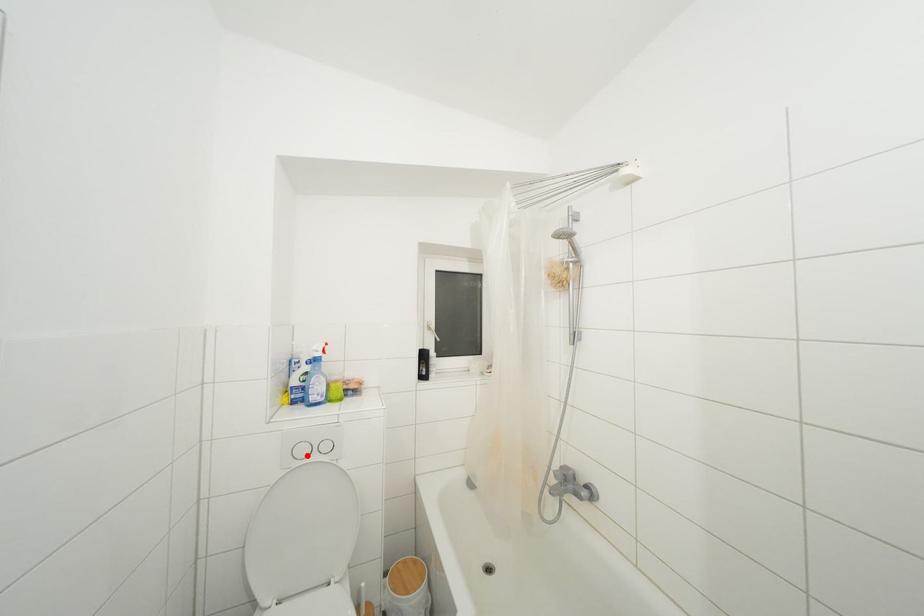
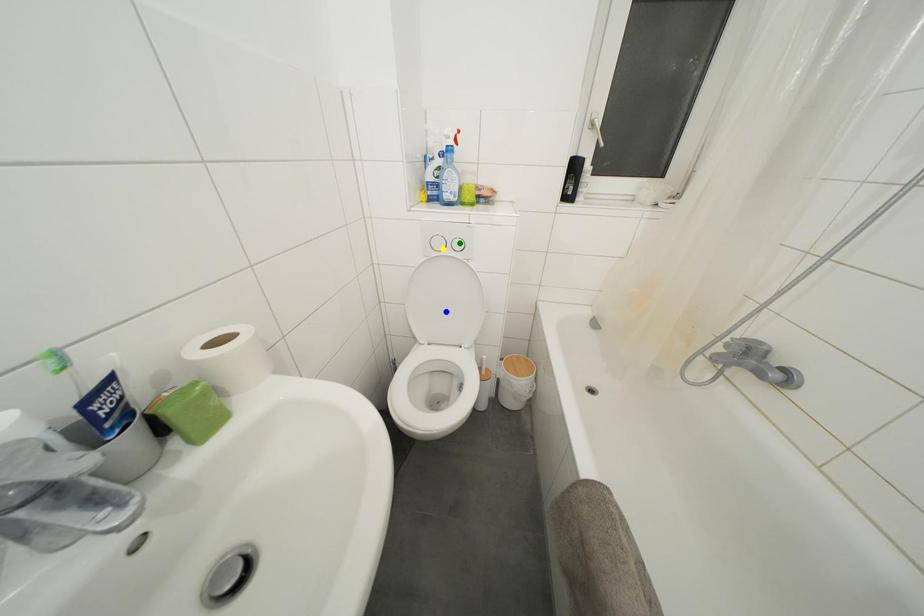
Question: I am providing you with two images of the same scene from different viewpoints. A red point is marked on the first image. You are given multiple points on the second image. Which mark in image 2 goes with the point in image 1?

Choices:
 (A) yellow point
 (B) green point
 (C) blue point

Answer: (A)